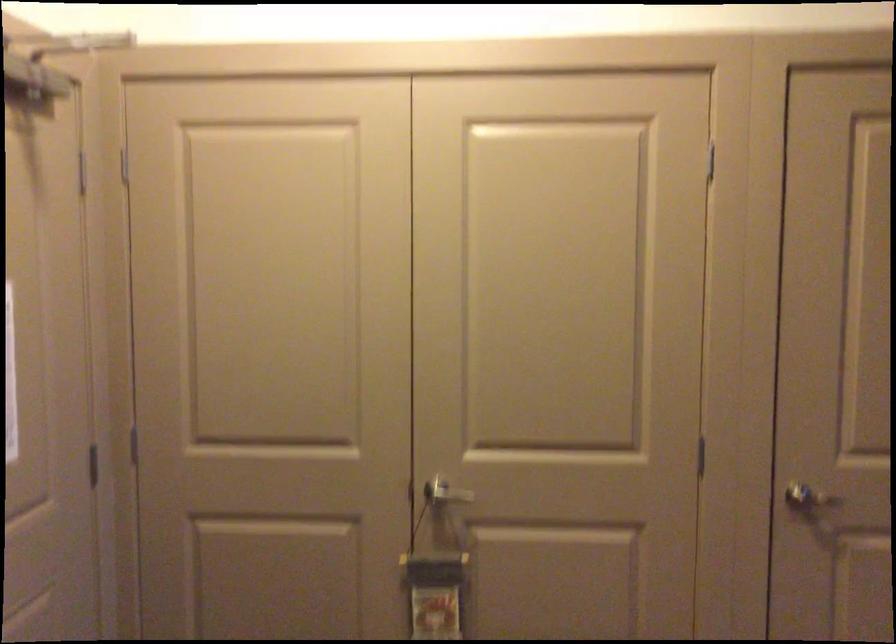
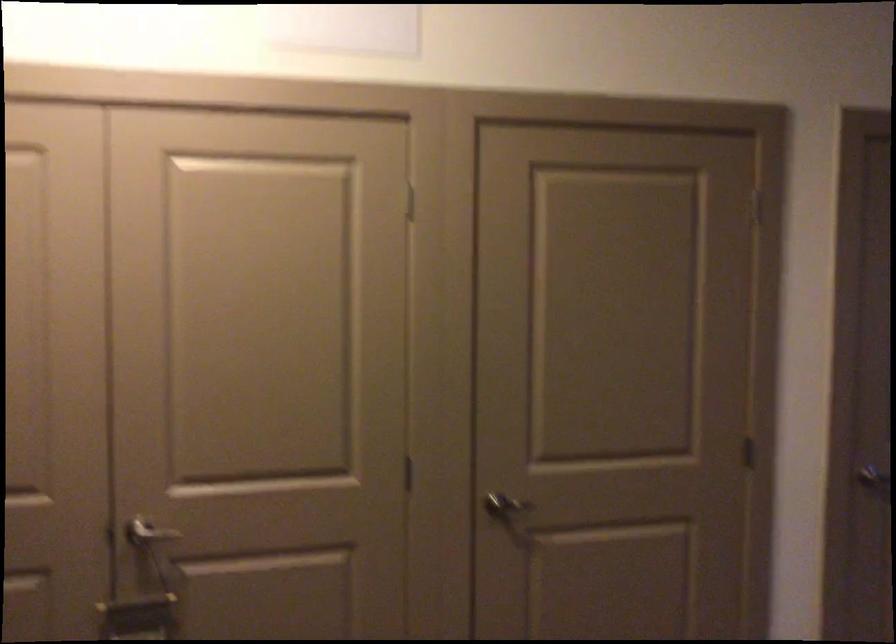
Locate, in the second image, the point that corresponds to (x=810, y=491) in the first image.

(504, 506)